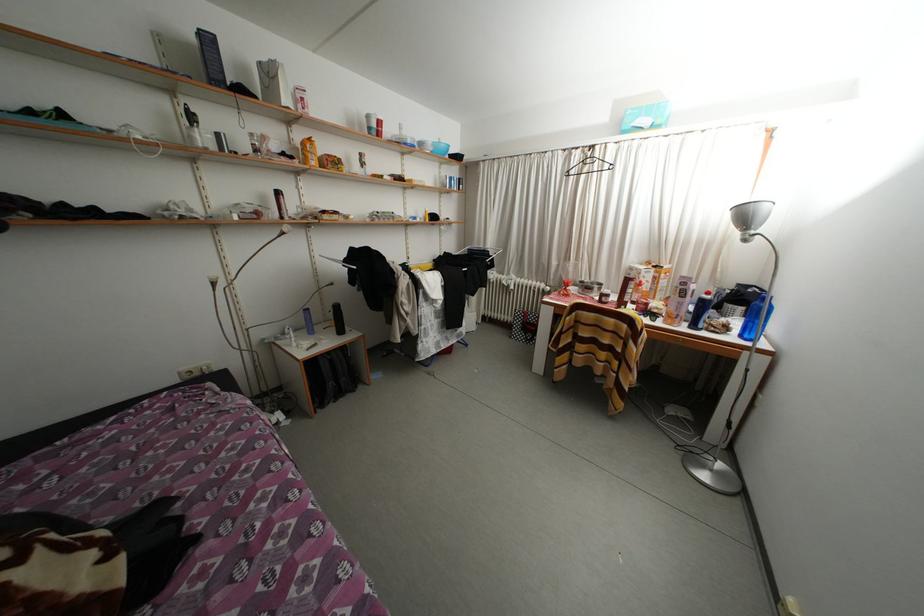
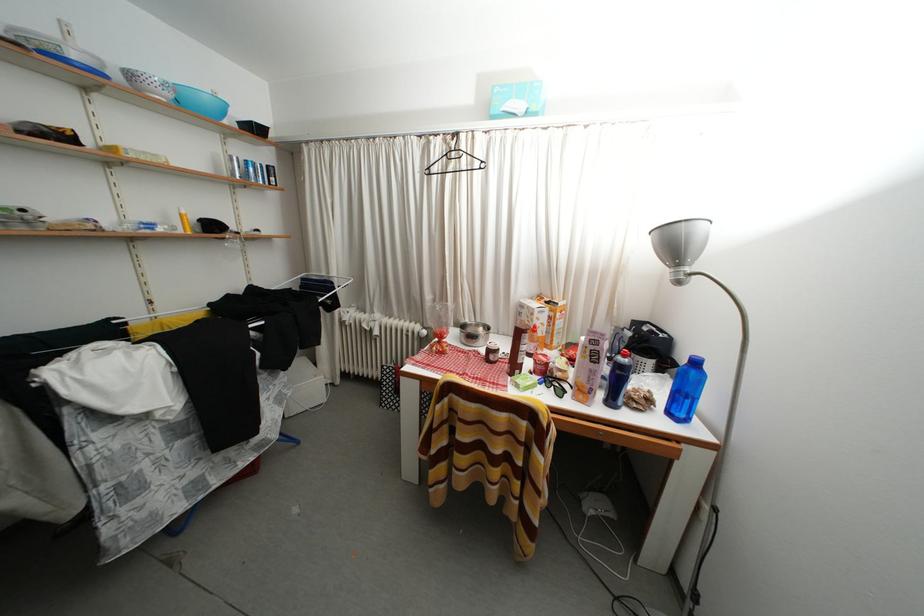
Where in the second image is the point corresponding to pixel 610 301 from the first image?

(496, 357)